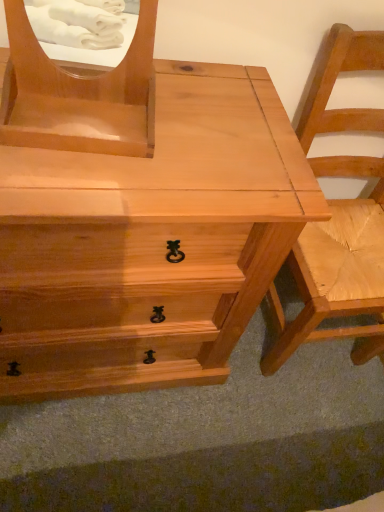
Locate an element on the screen. Image resolution: width=384 pixels, height=512 pixels. vacant space in front of matte wood mirror at upper left is located at coordinates (63, 183).